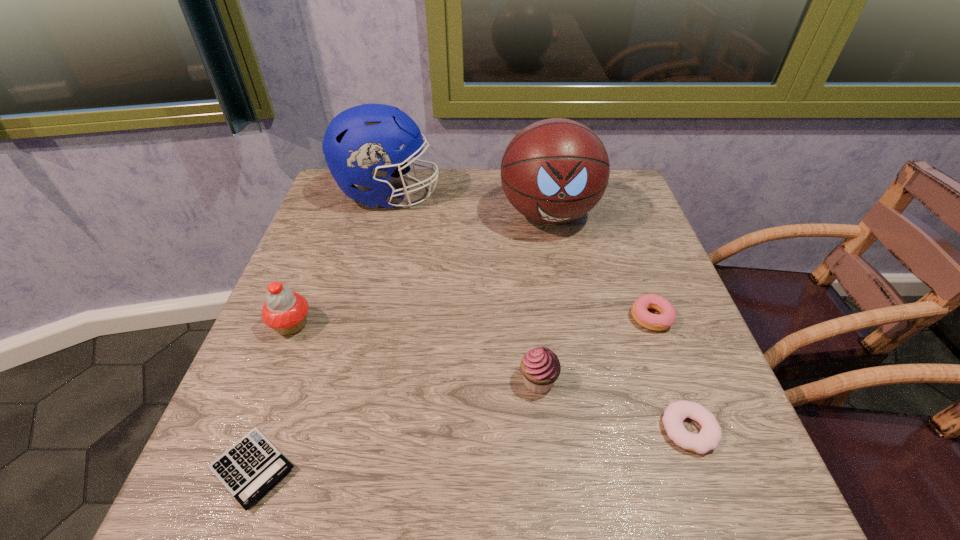
The image size is (960, 540). Identify the location of vacant space at the far edge of the desktop. click(x=497, y=208).

Find the location of a particular element. This screenshot has height=540, width=960. vacant space at the near edge is located at coordinates (415, 490).

Image resolution: width=960 pixels, height=540 pixels. I want to click on vacant region at the right edge of the desktop, so click(x=659, y=285).

At what (x,y) coordinates should I click in order to perform the action: click on vacant space at the far left corner. Please return your answer as a coordinate pair (x, y). Looking at the image, I should click on [314, 218].

The width and height of the screenshot is (960, 540). In the image, there is a desktop. What are the coordinates of `vacant area at the near right corner` in the screenshot? It's located at (704, 498).

At what (x,y) coordinates should I click in order to perform the action: click on empty space that is in between the farther doughnut and the shortest object. Please return your answer as a coordinate pair (x, y). The height and width of the screenshot is (540, 960). Looking at the image, I should click on (452, 393).

Identify the location of free space between the basketball and the left cupcake. (420, 269).

The width and height of the screenshot is (960, 540). Identify the location of free area in between the football helmet and the farther cupcake. (340, 260).

The image size is (960, 540). Find the location of `free space that is in between the basketball and the calculator`. free space that is in between the basketball and the calculator is located at coordinates (400, 341).

The height and width of the screenshot is (540, 960). Identify the location of free space between the second shortest object and the football helmet. (539, 312).